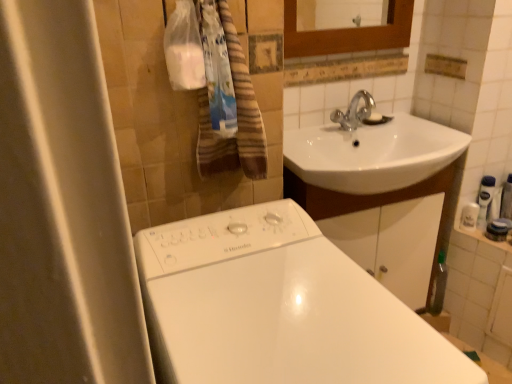
Question: Considering the positions of white plastic soap dispenser at right, acting as the first toiletry starting from the left, and white glossy bathtub at lower center in the image, is white plastic soap dispenser at right, acting as the first toiletry starting from the left, taller or shorter than white glossy bathtub at lower center?

Choices:
 (A) tall
 (B) short

Answer: (B)

Question: Considering their positions, is white plastic soap dispenser at right, which is the 2th toiletry from right to left, located in front of or behind white glossy bathtub at lower center?

Choices:
 (A) front
 (B) behind

Answer: (B)

Question: Which is nearer to the white glossy lotion at right, placed as the 2th toiletry when sorted from left to right?

Choices:
 (A) white glossy bathtub at lower center
 (B) white plastic soap dispenser at right, acting as the first toiletry starting from the left
 (C) brown striped towel at upper left

Answer: (B)

Question: Which of these objects is positioned closest to the white glossy bathtub at lower center?

Choices:
 (A) brown striped towel at upper left
 (B) white glossy lotion at right, the first toiletry viewed from the right
 (C) white plastic soap dispenser at right, acting as the first toiletry starting from the left

Answer: (A)